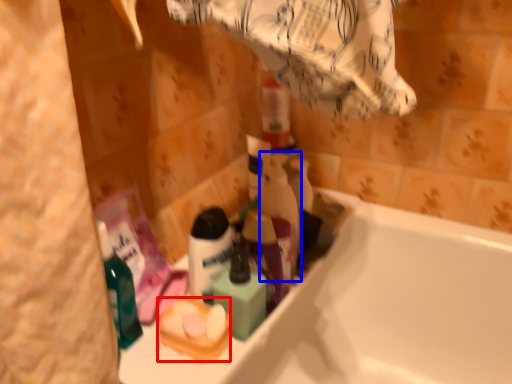
Question: Which object is closer to the camera taking this photo, product (highlighted by a red box) or cleaning product (highlighted by a blue box)?

Choices:
 (A) product
 (B) cleaning product

Answer: (A)